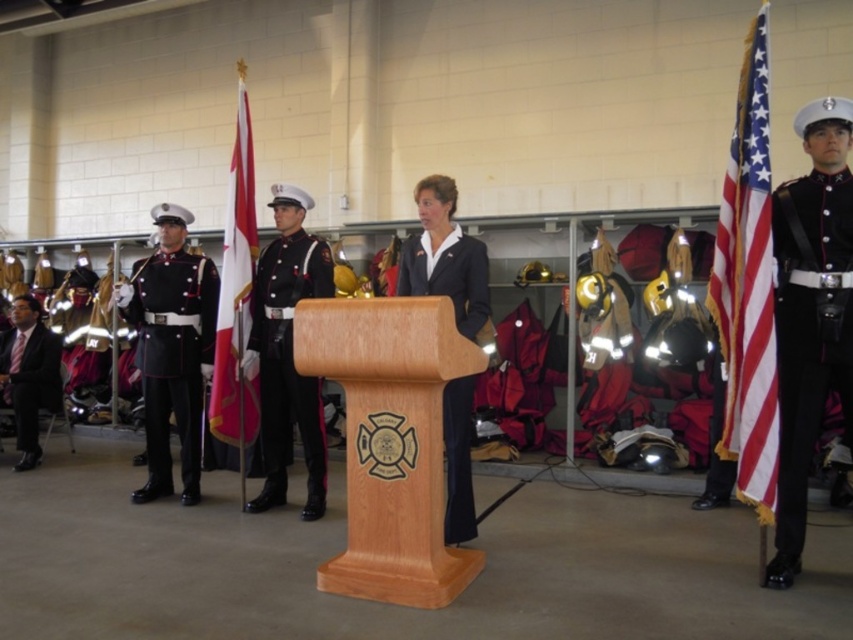
You are attending this event and need to find the taller person. Which one is taller between the black glossy uniform at right and the shiny black uniform at left?

The black glossy uniform at right is much taller than the shiny black uniform at left.

You are a photographer at the back of the hall. You want to take a photo of the black glossy uniform at center. Where should you aim your camera to capture it?

You should aim your camera at point 0.556 on the horizontal axis and 0.339 on the vertical axis to capture the black glossy uniform at center.